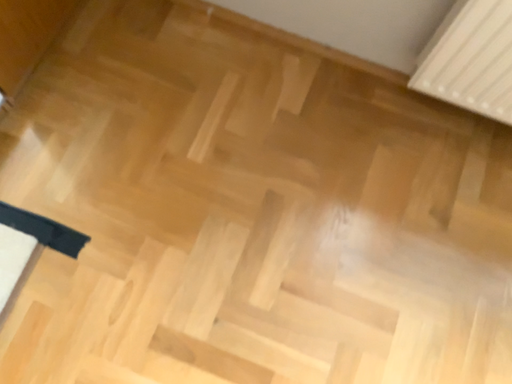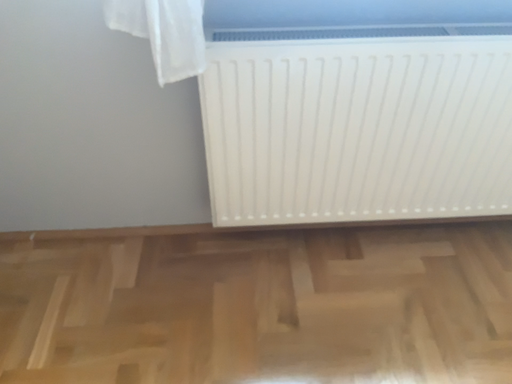
Question: Which way did the camera rotate in the video?

Choices:
 (A) rotated downward
 (B) rotated upward

Answer: (B)